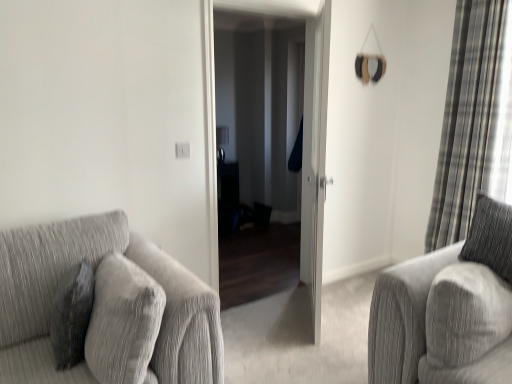
Question: In the image, is textured gray couch at left positioned in front of or behind plaid fabric curtain at right?

Choices:
 (A) front
 (B) behind

Answer: (A)

Question: Considering the positions of textured gray couch at left and plaid fabric curtain at right in the image, is textured gray couch at left wider or thinner than plaid fabric curtain at right?

Choices:
 (A) thin
 (B) wide

Answer: (B)

Question: Which is farther from the white glossy door at center, placed as the first screen door when sorted from right to left?

Choices:
 (A) textured gray couch at left
 (B) velvet dark gray pillow at left
 (C) matte black screen door at center, the second screen door viewed from the right
 (D) plaid fabric curtain at right

Answer: (B)

Question: Which is nearer to the matte black screen door at center, arranged as the 1th screen door when viewed from the left?

Choices:
 (A) textured gray couch at left
 (B) white glossy door at center, placed as the first screen door when sorted from right to left
 (C) velvet dark gray pillow at left
 (D) plaid fabric curtain at right

Answer: (B)